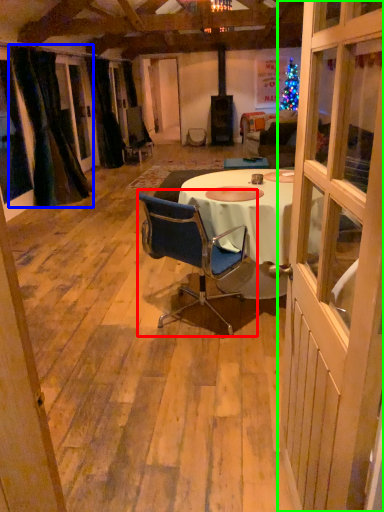
Question: Estimate the real-world distances between objects in this image. Which object is farther from chair (highlighted by a red box), curtain (highlighted by a blue box) or door (highlighted by a green box)?

Choices:
 (A) curtain
 (B) door

Answer: (A)